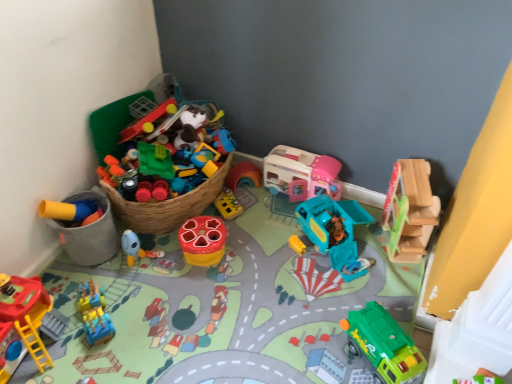
Question: Can we say wooden slide at upper right, which is counted as the 8th toy, starting from the left, lies outside green matte truck at lower right, arranged as the second toy when viewed from the right?

Choices:
 (A) no
 (B) yes

Answer: (B)

Question: Could you tell me if wooden slide at upper right, which is counted as the 8th toy, starting from the left, is facing green matte truck at lower right, arranged as the second toy when viewed from the right?

Choices:
 (A) no
 (B) yes

Answer: (B)

Question: Are wooden slide at upper right, arranged as the first toy when viewed from the right, and green matte truck at lower right, which is the 7th toy from left to right, beside each other?

Choices:
 (A) no
 (B) yes

Answer: (A)

Question: Is wooden slide at upper right, which is counted as the 8th toy, starting from the left, positioned in front of green matte truck at lower right, which is the 7th toy from left to right?

Choices:
 (A) yes
 (B) no

Answer: (B)

Question: From a real-world perspective, is wooden slide at upper right, which is counted as the 8th toy, starting from the left, physically above green matte truck at lower right, which is the 7th toy from left to right?

Choices:
 (A) yes
 (B) no

Answer: (A)

Question: Is there a large distance between wooden slide at upper right, arranged as the first toy when viewed from the right, and green matte truck at lower right, which is the 7th toy from left to right?

Choices:
 (A) no
 (B) yes

Answer: (A)

Question: Is green matte truck at lower right, which is the 7th toy from left to right, further to the viewer compared to wooden slide at upper right, arranged as the first toy when viewed from the right?

Choices:
 (A) no
 (B) yes

Answer: (A)

Question: From the image's perspective, is green matte truck at lower right, which is the 7th toy from left to right, below wooden slide at upper right, arranged as the first toy when viewed from the right?

Choices:
 (A) no
 (B) yes

Answer: (B)

Question: Can you confirm if green matte truck at lower right, arranged as the second toy when viewed from the right, is shorter than wooden slide at upper right, arranged as the first toy when viewed from the right?

Choices:
 (A) no
 (B) yes

Answer: (B)

Question: Is green matte truck at lower right, which is the 7th toy from left to right, smaller than wooden slide at upper right, which is counted as the 8th toy, starting from the left?

Choices:
 (A) yes
 (B) no

Answer: (A)

Question: Can you confirm if green matte truck at lower right, arranged as the second toy when viewed from the right, is positioned to the left of wooden slide at upper right, arranged as the first toy when viewed from the right?

Choices:
 (A) yes
 (B) no

Answer: (A)

Question: Is green matte truck at lower right, arranged as the second toy when viewed from the right, closer to the viewer compared to wooden slide at upper right, which is counted as the 8th toy, starting from the left?

Choices:
 (A) yes
 (B) no

Answer: (A)

Question: From a real-world perspective, is blue rubber duck at center, which is the 3th toy in left-to-right order, on teal plastic truck at center, which ranks as the third toy in right-to-left order?

Choices:
 (A) no
 (B) yes

Answer: (A)